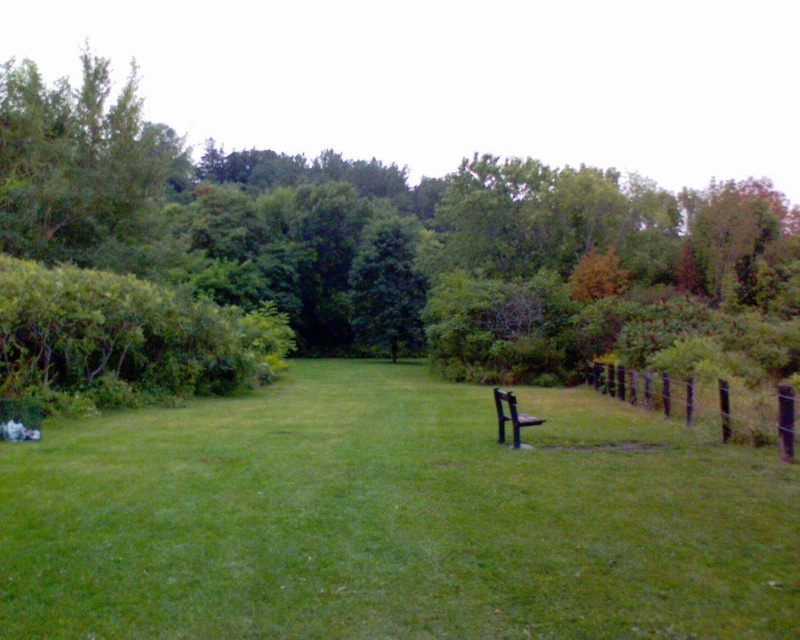
Question: Can you confirm if green grassy at center is thinner than green leafy tree at center?

Choices:
 (A) yes
 (B) no

Answer: (A)

Question: Which object is the closest to the green grassy at center?

Choices:
 (A) green leafy tree at center
 (B) brown wooden fence at right

Answer: (B)

Question: Estimate the real-world distances between objects in this image. Which object is farther from the green grassy at center?

Choices:
 (A) brown wooden fence at right
 (B) green leafy tree at center

Answer: (B)

Question: Does brown wooden fence at right have a greater width compared to black metal bench at center?

Choices:
 (A) no
 (B) yes

Answer: (B)

Question: Is green grassy at center to the left of green leafy tree at center from the viewer's perspective?

Choices:
 (A) no
 (B) yes

Answer: (A)

Question: Which object is the closest to the brown wooden fence at right?

Choices:
 (A) green grassy at center
 (B) black metal bench at center

Answer: (B)